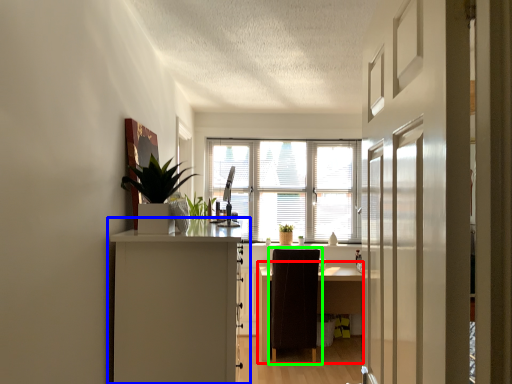
Question: Considering the real-world distances, which object is closest to desk (highlighted by a red box)? cabinetry (highlighted by a blue box) or chair (highlighted by a green box).

Choices:
 (A) cabinetry
 (B) chair

Answer: (B)